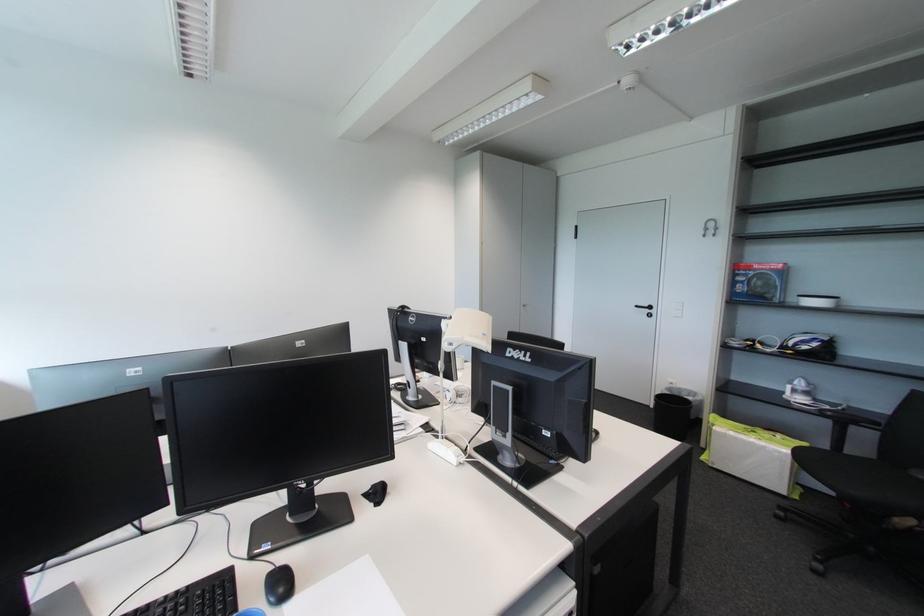
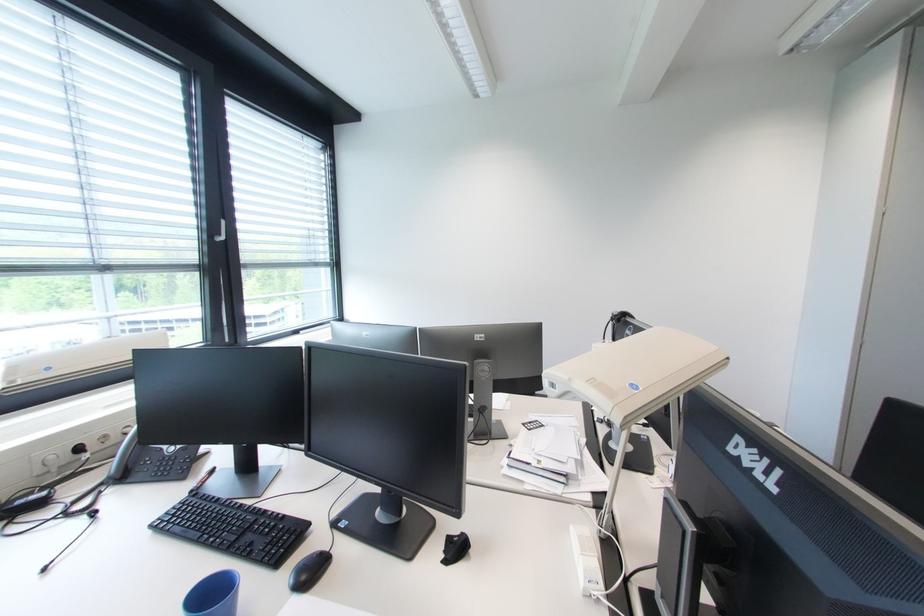
Where in the second image is the point corresponding to (195,589) from the first image?

(290, 517)